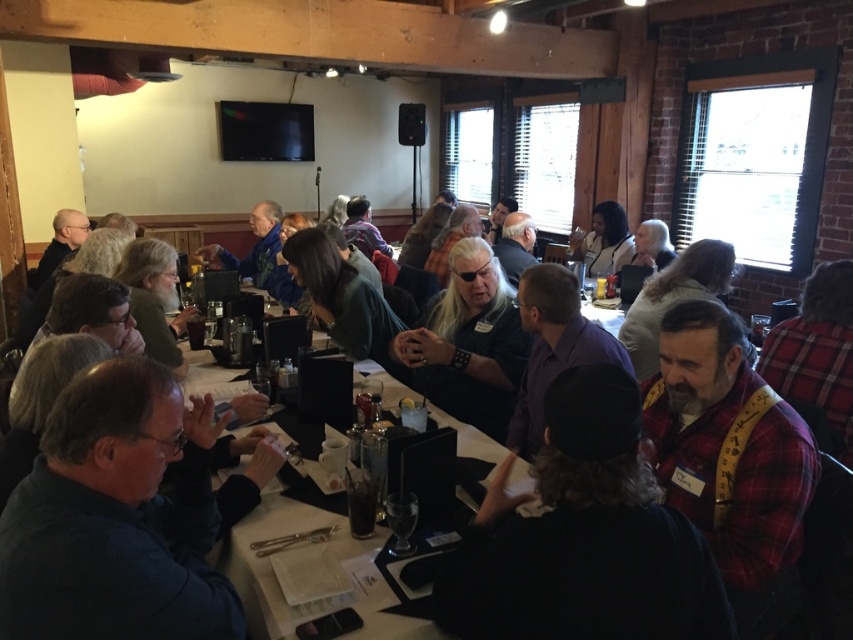
Based on the photo, you are at the gathering and want to greet the person wearing the purple shirt at center and the person wearing the matte black jacket at center. If you start from the left side of the table, which person should you approach first?

The purple shirt at center is positioned on the left side of matte black jacket at center, so you should approach the purple shirt at center first when starting from the left side of the table.

You are at the event and want to hand a drink to the person wearing the purple shirt at center without disturbing the person in the plaid flannel shirt at right. Which direction should you approach from?

You should approach from the left side of the purple shirt at center because the plaid flannel shirt at right is above it, meaning the plaid flannel shirt at right is positioned to the right of the purple shirt at center and might block access from that direction.